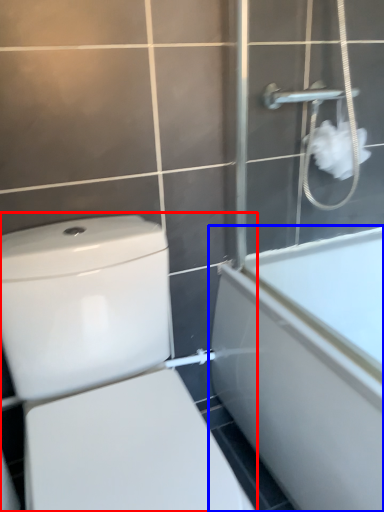
Question: Which object appears closest to the camera in this image, toilet (highlighted by a red box) or bathtub (highlighted by a blue box)?

Choices:
 (A) toilet
 (B) bathtub

Answer: (A)